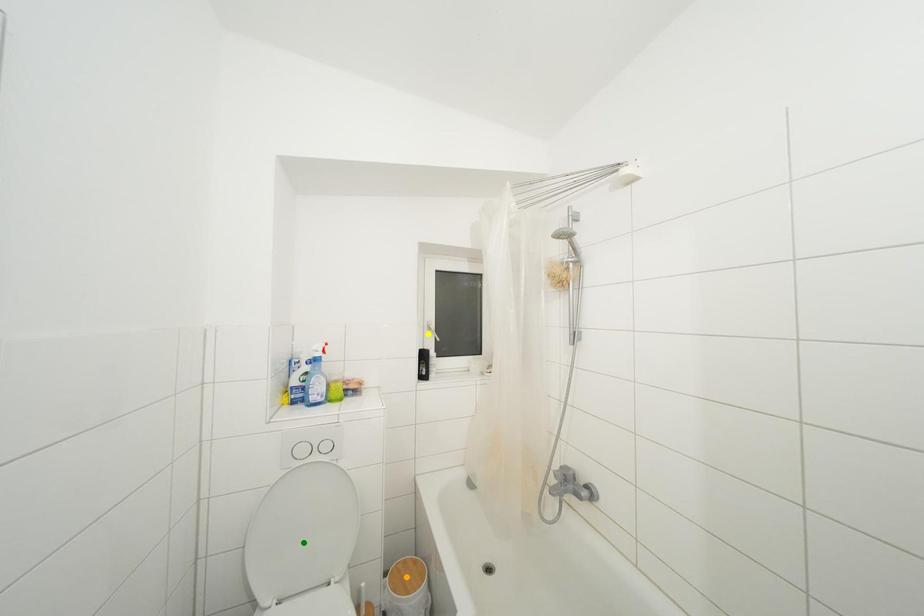
Order these from nearest to farthest:
orange point, green point, yellow point

green point < orange point < yellow point